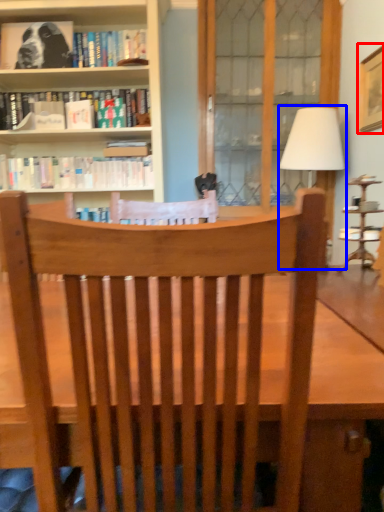
Question: Which of the following is the farthest to the observer, picture frame (highlighted by a red box) or table lamp (highlighted by a blue box)?

Choices:
 (A) picture frame
 (B) table lamp

Answer: (B)